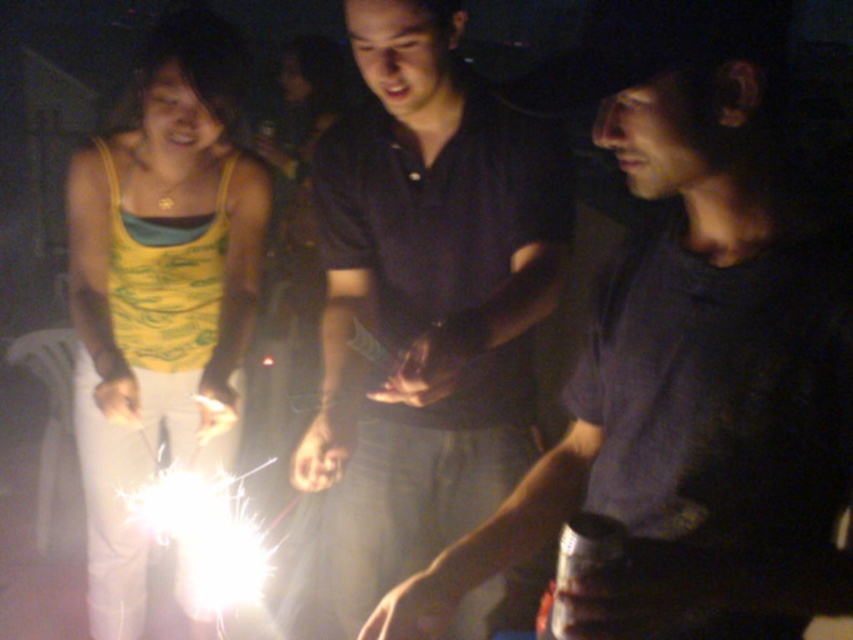
Does matte black shirt at center appear under yellow printed tank top at left?

Incorrect, matte black shirt at center is not positioned below yellow printed tank top at left.

Does matte black shirt at center have a larger size compared to yellow printed tank top at left?

Actually, matte black shirt at center might be smaller than yellow printed tank top at left.

I want to click on matte black shirt at center, so click(689, 352).

Is dark purple shirt at center shorter than yellow printed tank top at left?

Yes.

Who is shorter, dark purple shirt at center or yellow printed tank top at left?

With less height is dark purple shirt at center.

Which is behind, point (480, 625) or point (115, 324)?

Point (115, 324)

At what (x,y) coordinates should I click in order to perform the action: click on dark purple shirt at center. Please return your answer as a coordinate pair (x, y). Looking at the image, I should click on (425, 300).

Does matte black shirt at center appear on the right side of dark purple shirt at center?

Indeed, matte black shirt at center is positioned on the right side of dark purple shirt at center.

Is point (730, 305) less distant than point (402, 173)?

Yes.

Image resolution: width=853 pixels, height=640 pixels. Find the location of `matte black shirt at center`. matte black shirt at center is located at coordinates (689, 352).